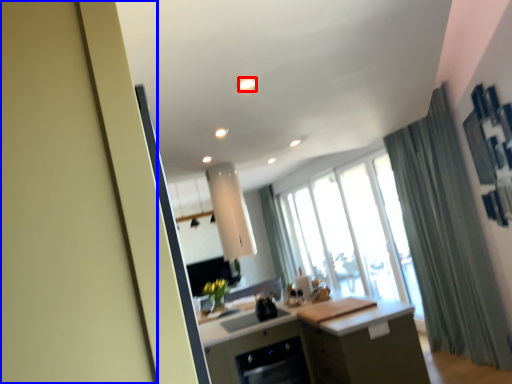
Question: Which of the following is the farthest to the observer, light (highlighted by a red box) or screen door (highlighted by a blue box)?

Choices:
 (A) light
 (B) screen door

Answer: (A)